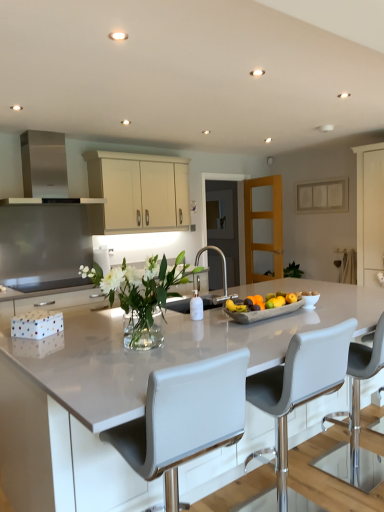
Question: Is cream matte cabinet at upper center bigger than clear glass vase at center?

Choices:
 (A) no
 (B) yes

Answer: (B)

Question: Could you tell me if cream matte cabinet at upper center is facing clear glass vase at center?

Choices:
 (A) no
 (B) yes

Answer: (B)

Question: Does cream matte cabinet at upper center have a greater width compared to clear glass vase at center?

Choices:
 (A) yes
 (B) no

Answer: (B)

Question: Can you confirm if cream matte cabinet at upper center is smaller than clear glass vase at center?

Choices:
 (A) no
 (B) yes

Answer: (A)

Question: Is cream matte cabinet at upper center shorter than clear glass vase at center?

Choices:
 (A) no
 (B) yes

Answer: (A)

Question: In terms of size, does cream matte cabinet at upper center appear bigger or smaller than light brown wooden door at center, placed as the first glass door when sorted from right to left?

Choices:
 (A) small
 (B) big

Answer: (B)

Question: Considering the relative positions of cream matte cabinet at upper center and light brown wooden door at center, the 2th glass door positioned from the left, in the image provided, is cream matte cabinet at upper center to the left or to the right of light brown wooden door at center, the 2th glass door positioned from the left,?

Choices:
 (A) right
 (B) left

Answer: (B)

Question: Is point (178, 182) closer or farther from the camera than point (243, 187)?

Choices:
 (A) farther
 (B) closer

Answer: (B)

Question: Is cream matte cabinet at upper center taller or shorter than light brown wooden door at center, the 2th glass door positioned from the left?

Choices:
 (A) short
 (B) tall

Answer: (A)

Question: Considering their positions, is white leather chair at center, placed as the first chair when sorted from left to right, located in front of or behind light brown wooden door at center, placed as the first glass door when sorted from right to left?

Choices:
 (A) front
 (B) behind

Answer: (A)

Question: Would you say white leather chair at center, arranged as the 2th chair when viewed from the right, is to the left or to the right of light brown wooden door at center, placed as the first glass door when sorted from right to left, in the picture?

Choices:
 (A) right
 (B) left

Answer: (B)

Question: From the image's perspective, is white leather chair at center, arranged as the 2th chair when viewed from the right, above or below light brown wooden door at center, the 2th glass door positioned from the left?

Choices:
 (A) below
 (B) above

Answer: (A)

Question: In terms of width, does white leather chair at center, arranged as the 2th chair when viewed from the right, look wider or thinner when compared to light brown wooden door at center, the 2th glass door positioned from the left?

Choices:
 (A) thin
 (B) wide

Answer: (B)

Question: Is concrete tray of fruits at center wider or thinner than clear glass door at center, the 1th glass door when ordered from left to right?

Choices:
 (A) thin
 (B) wide

Answer: (B)

Question: Relative to clear glass door at center, which is counted as the second glass door, starting from the right, is concrete tray of fruits at center in front or behind?

Choices:
 (A) front
 (B) behind

Answer: (A)